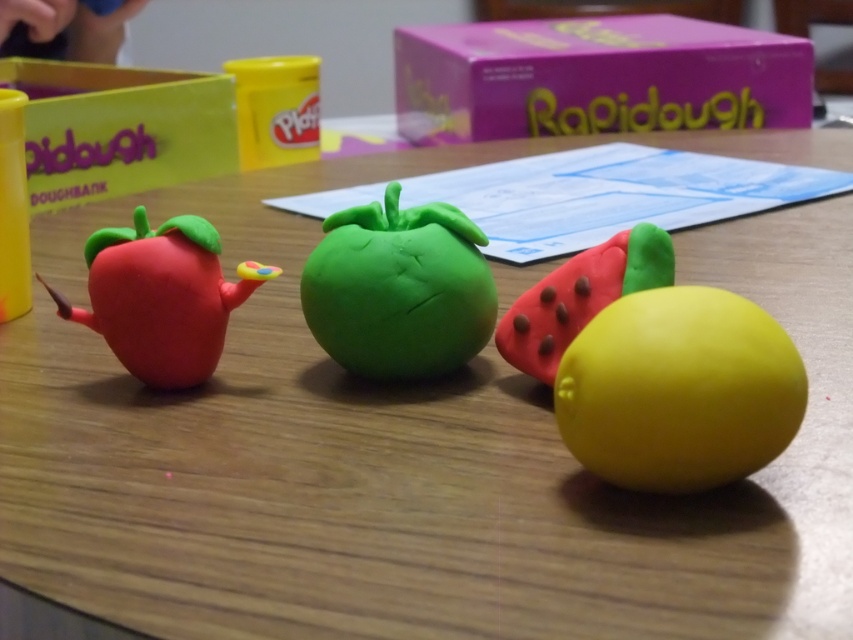
Is point (315, 323) closer to camera compared to point (149, 252)?

No, (315, 323) is further to viewer.

Between green clay apple at center and matte plastic strawberry at left, which one has more height?

green clay apple at center is taller.

Who is more distant from viewer, [448,310] or [199,221]?

The point [199,221] is more distant.

Locate an element on the screen. Image resolution: width=853 pixels, height=640 pixels. green clay apple at center is located at coordinates (399, 289).

Between matte yellow box at upper left and rubberized matte strawberry at center-right, which one is positioned lower?

Positioned lower is rubberized matte strawberry at center-right.

Is point (61, 161) positioned before point (549, 358)?

No, (61, 161) is behind (549, 358).

Is point (27, 176) closer to camera compared to point (625, 237)?

No.

This screenshot has width=853, height=640. Find the location of `matte yellow box at upper left`. matte yellow box at upper left is located at coordinates (119, 129).

Can you confirm if pink cardboard box at upper center is wider than green clay apple at center?

Yes.

Identify the location of pink cardboard box at upper center. This screenshot has width=853, height=640. 595,77.